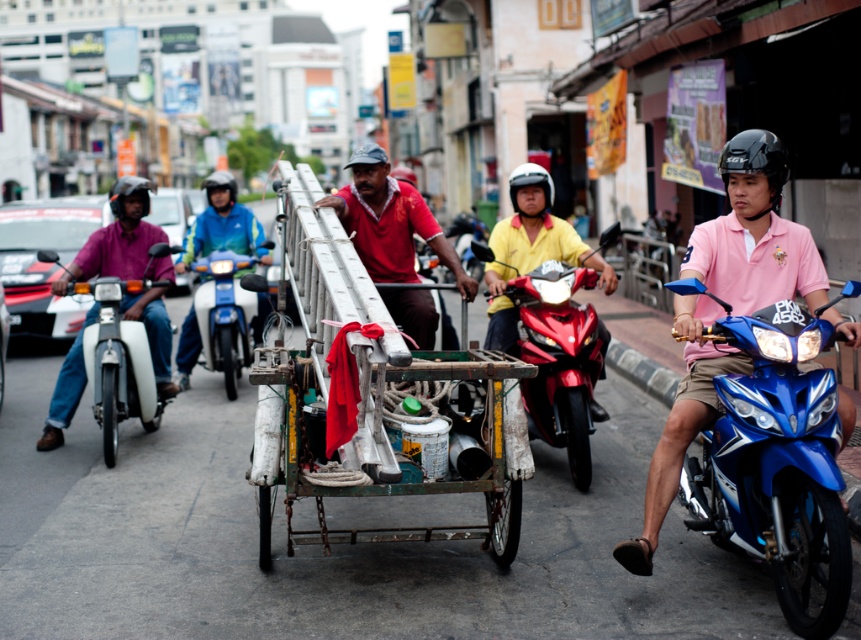
Does rusty metal cart at center have a lesser width compared to matte black helmet at center?

Indeed, rusty metal cart at center has a lesser width compared to matte black helmet at center.

Who is positioned more to the right, rusty metal cart at center or matte black helmet at center?

rusty metal cart at center is more to the right.

Does point (431, 481) lie behind point (406, 173)?

No, (431, 481) is in front of (406, 173).

In order to click on rusty metal cart at center in this screenshot , I will do `click(362, 392)`.

Can you confirm if shiny red motorcycle at center is positioned to the left of red matte shirt at center?

Incorrect, shiny red motorcycle at center is not on the left side of red matte shirt at center.

Between point (568, 328) and point (376, 276), which one is positioned behind?

Point (376, 276)

Where is `shiny red motorcycle at center`? This screenshot has height=640, width=861. shiny red motorcycle at center is located at coordinates (558, 356).

You are a GUI agent. You are given a task and a screenshot of the screen. Output one action in this format:
    pyautogui.click(x=<x>, y=<y>)
    Task: Click on the shiny red motorcycle at center
    Image resolution: width=861 pixels, height=640 pixels.
    Given the screenshot: What is the action you would take?
    pyautogui.click(x=558, y=356)

Does rusty metal cart at center have a greater width compared to pink cotton shirt at right?

Yes, rusty metal cart at center is wider than pink cotton shirt at right.

In the scene shown: Can you confirm if rusty metal cart at center is shorter than pink cotton shirt at right?

Incorrect, rusty metal cart at center's height does not fall short of pink cotton shirt at right's.

What do you see at coordinates (362, 392) in the screenshot?
I see `rusty metal cart at center` at bounding box center [362, 392].

Identify the location of rusty metal cart at center. (362, 392).